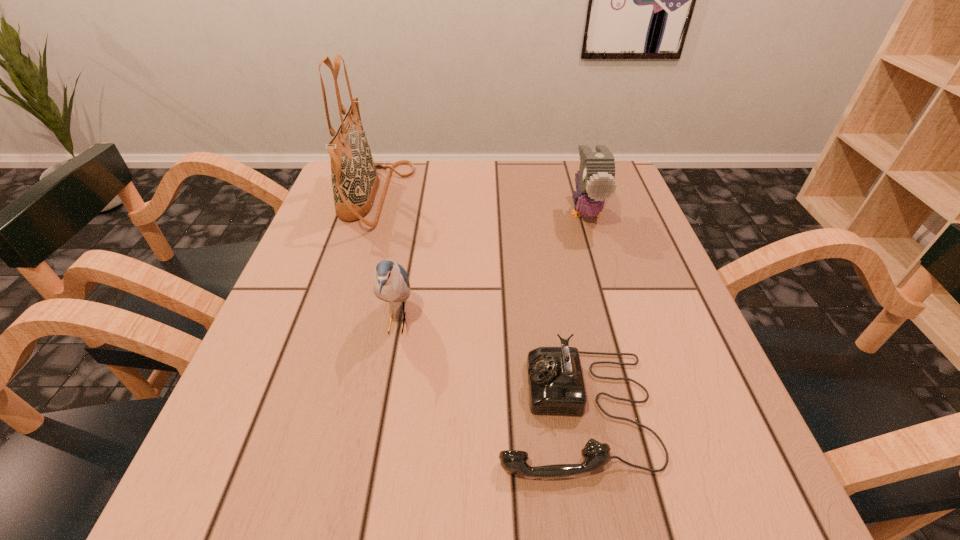
In order to click on free point that satisfies the following two spatial constraints: 1. at the beak of the farther bird; 2. on the dial of the shortest object in this screenshot , I will do `click(645, 410)`.

Locate an element on the screen. The height and width of the screenshot is (540, 960). free spot that satisfies the following two spatial constraints: 1. at the beak of the right bird; 2. on the dial of the nearest object is located at coordinates (645, 410).